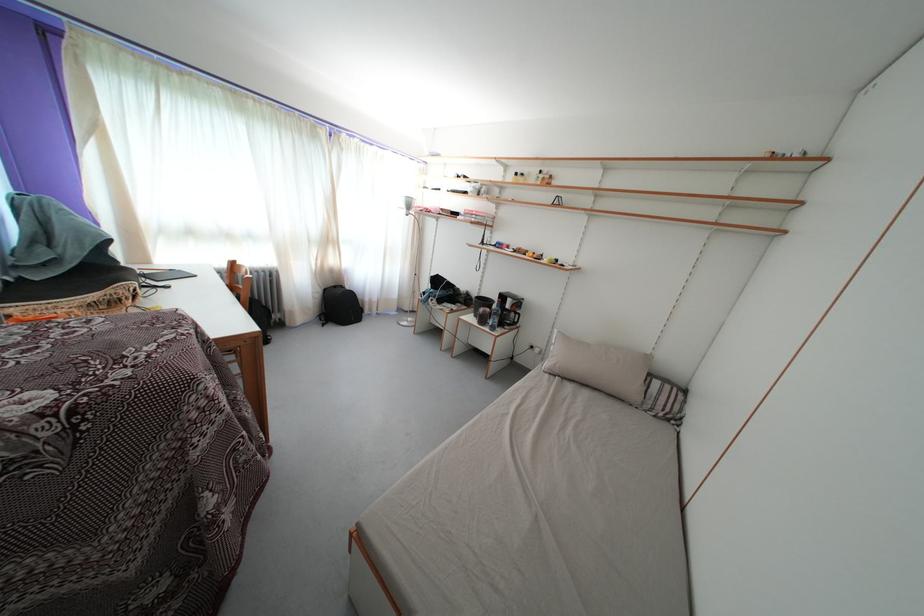
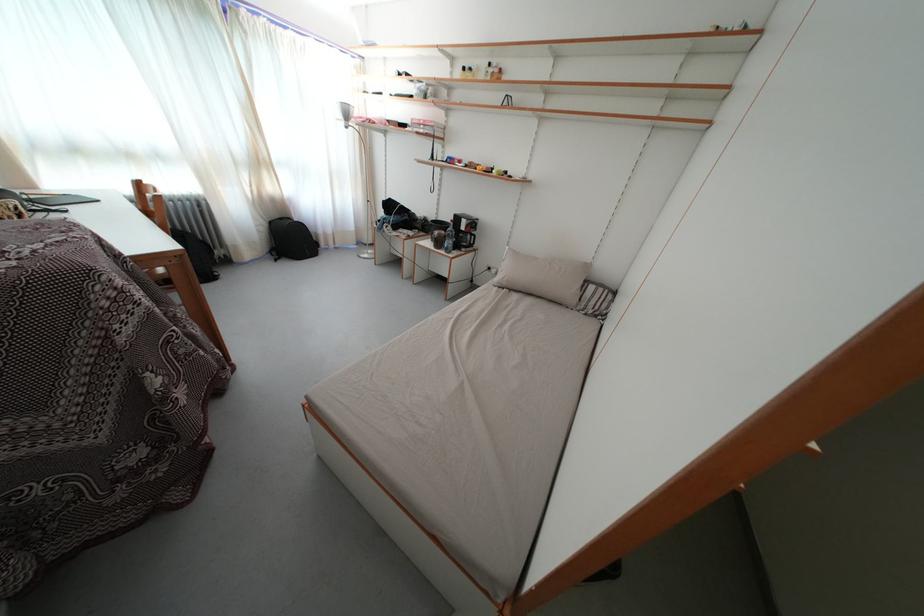
Locate, in the second image, the point that corresponds to pixel 509 317 in the first image.

(467, 240)